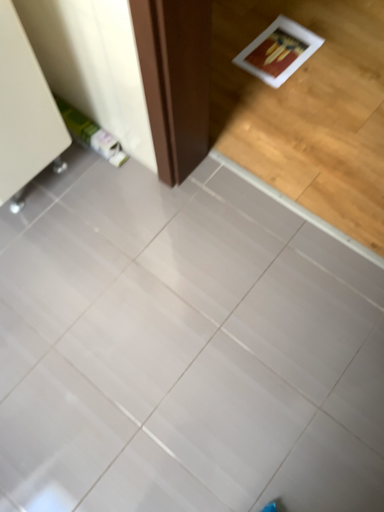
Question: Does white glossy tile at center have a greater height compared to white glossy cabinet at upper left?

Choices:
 (A) yes
 (B) no

Answer: (B)

Question: Is white glossy tile at center positioned beyond the bounds of white glossy cabinet at upper left?

Choices:
 (A) yes
 (B) no

Answer: (A)

Question: Is white glossy tile at center not close to white glossy cabinet at upper left?

Choices:
 (A) yes
 (B) no

Answer: (B)

Question: Considering the relative positions of white glossy tile at center and white glossy cabinet at upper left in the image provided, is white glossy tile at center to the left of white glossy cabinet at upper left from the viewer's perspective?

Choices:
 (A) no
 (B) yes

Answer: (A)

Question: Is white glossy cabinet at upper left completely or partially inside white glossy tile at center?

Choices:
 (A) no
 (B) yes

Answer: (A)

Question: Is white glossy tile at center beside white glossy cabinet at upper left?

Choices:
 (A) yes
 (B) no

Answer: (B)

Question: Would you say white glossy cabinet at upper left is a long distance from white glossy tile at center?

Choices:
 (A) no
 (B) yes

Answer: (A)

Question: Considering the relative positions of white glossy cabinet at upper left and white glossy tile at center in the image provided, is white glossy cabinet at upper left to the right of white glossy tile at center from the viewer's perspective?

Choices:
 (A) no
 (B) yes

Answer: (A)

Question: Is white glossy cabinet at upper left closer to the viewer compared to white glossy tile at center?

Choices:
 (A) yes
 (B) no

Answer: (B)

Question: Does white glossy cabinet at upper left lie behind white glossy tile at center?

Choices:
 (A) no
 (B) yes

Answer: (B)

Question: From a real-world perspective, does white glossy cabinet at upper left sit lower than white glossy tile at center?

Choices:
 (A) no
 (B) yes

Answer: (A)

Question: Is white glossy cabinet at upper left shorter than white glossy tile at center?

Choices:
 (A) yes
 (B) no

Answer: (B)

Question: Considering the positions of white glossy tile at center and white glossy cabinet at upper left in the image, is white glossy tile at center wider or thinner than white glossy cabinet at upper left?

Choices:
 (A) wide
 (B) thin

Answer: (A)